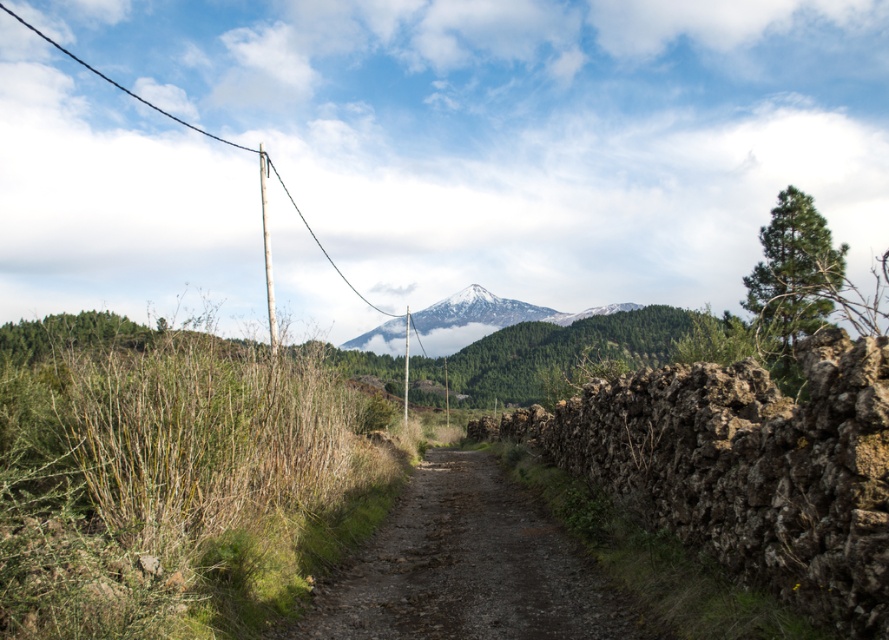
Is dusty gravel path at center below snow-covered mountain at center?

Correct, dusty gravel path at center is located below snow-covered mountain at center.

Find the location of a particular element. dusty gravel path at center is located at coordinates (465, 566).

In order to click on dusty gravel path at center in this screenshot , I will do `click(465, 566)`.